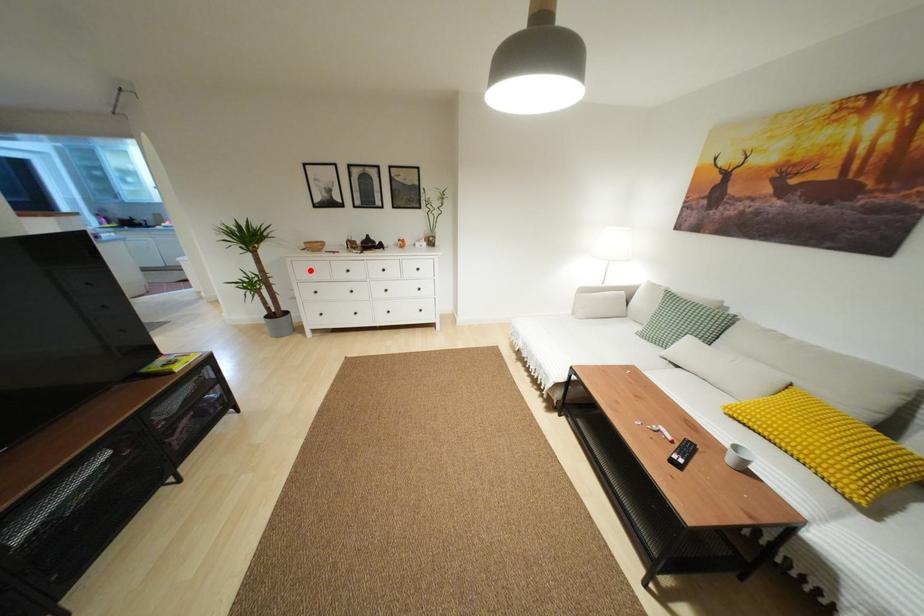
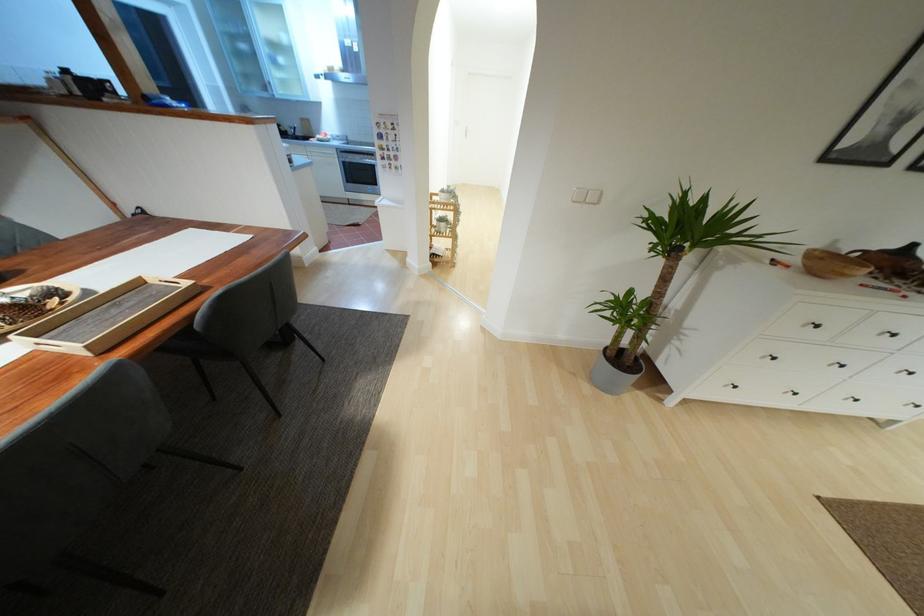
Locate, in the second image, the point that corresponds to the highlighted location in the first image.

(817, 326)